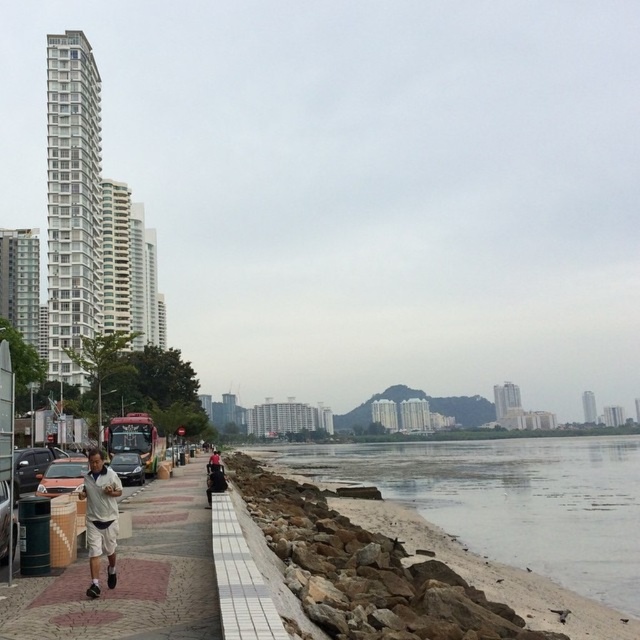
Is the position of gray rocky shore at lower left more distant than that of white matte shorts at lower left?

Yes, it is.

Which is more to the right, gray rocky shore at lower left or white matte shorts at lower left?

Positioned to the right is gray rocky shore at lower left.

The height and width of the screenshot is (640, 640). I want to click on gray rocky shore at lower left, so click(x=508, y=499).

In order to click on gray rocky shore at lower left in this screenshot , I will do `click(508, 499)`.

Does white tile curb at lower center appear over white matte shorts at lower left?

Indeed, white tile curb at lower center is positioned over white matte shorts at lower left.

Find the location of `white tile curb at lower center`. white tile curb at lower center is located at coordinates (241, 579).

You are a GUI agent. You are given a task and a screenshot of the screen. Output one action in this format:
    pyautogui.click(x=<x>, y=<y>)
    Task: Click on the white tile curb at lower center
    The height and width of the screenshot is (640, 640).
    Given the screenshot: What is the action you would take?
    pyautogui.click(x=241, y=579)

Is the position of white tile curb at lower center more distant than that of metallic silver car at left?

No, it is in front of metallic silver car at left.

The width and height of the screenshot is (640, 640). Find the location of `white tile curb at lower center`. white tile curb at lower center is located at coordinates (241, 579).

Locate an element on the screen. The width and height of the screenshot is (640, 640). white tile curb at lower center is located at coordinates (241, 579).